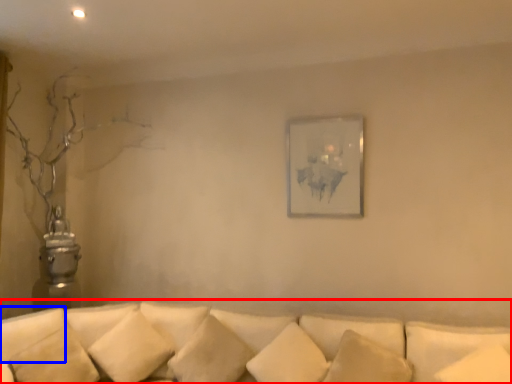
Question: Which object is closer to the camera taking this photo, studio couch (highlighted by a red box) or pillow (highlighted by a blue box)?

Choices:
 (A) studio couch
 (B) pillow

Answer: (A)